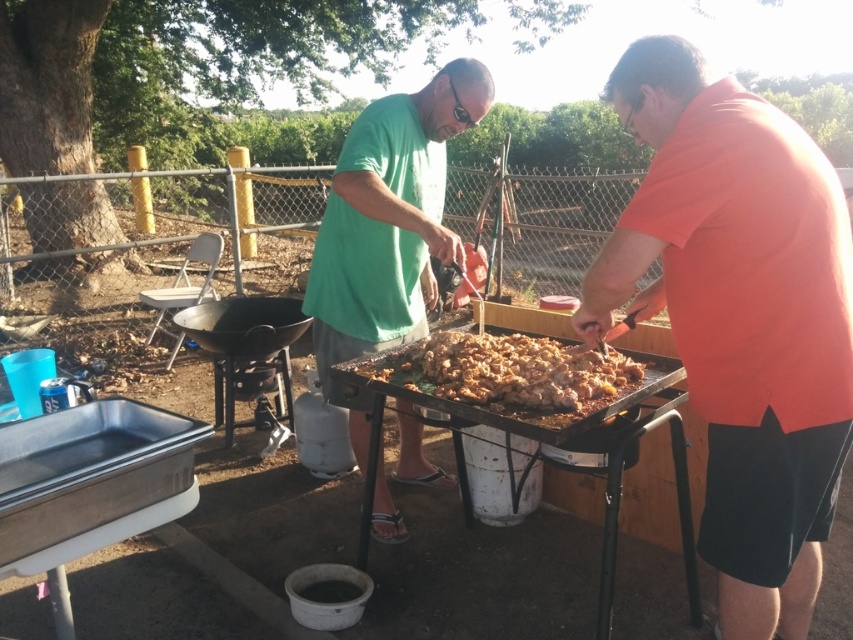
Question: Which object is farther from the camera taking this photo?

Choices:
 (A) brown crumbly meat at center
 (B) orange matte shirt at center
 (C) green matte shirt at center

Answer: (C)

Question: Which of these objects is positioned closest to the brown crumbly meat at center?

Choices:
 (A) green matte shirt at center
 (B) orange matte shirt at center

Answer: (A)

Question: Considering the relative positions of orange matte shirt at center and brown crumbly meat at center in the image provided, where is orange matte shirt at center located with respect to brown crumbly meat at center?

Choices:
 (A) left
 (B) right

Answer: (B)

Question: Is orange matte shirt at center above brown crumbly meat at center?

Choices:
 (A) yes
 (B) no

Answer: (B)

Question: Which of the following is the farthest from the observer?

Choices:
 (A) (366, 273)
 (B) (735, 380)

Answer: (A)

Question: Is orange matte shirt at center to the right of green matte shirt at center from the viewer's perspective?

Choices:
 (A) yes
 (B) no

Answer: (A)